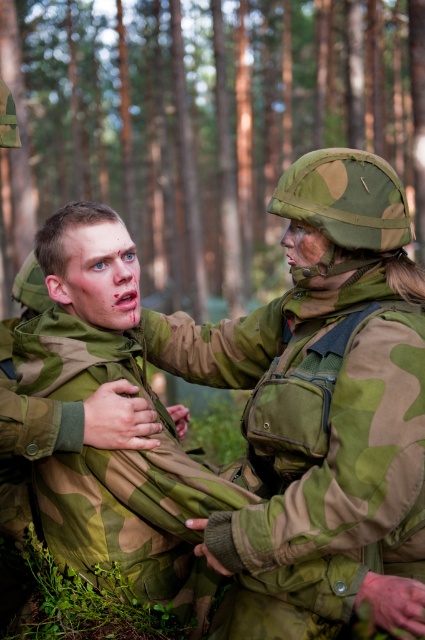
Question: Can you confirm if green camouflage pine forest at upper center is smaller than camo uniform at center?

Choices:
 (A) no
 (B) yes

Answer: (A)

Question: Which of these objects is positioned farthest from the camouflage fabric uniform at center?

Choices:
 (A) camo uniform at center
 (B) green camouflage pine forest at upper center

Answer: (B)

Question: Which of the following is the farthest from the observer?

Choices:
 (A) (275, 154)
 (B) (339, 224)
 (C) (187, 497)

Answer: (A)

Question: Does green camouflage pine forest at upper center have a greater width compared to camouflage fabric uniform at center?

Choices:
 (A) yes
 (B) no

Answer: (A)

Question: Can you confirm if green camouflage pine forest at upper center is positioned to the left of camouflage fabric uniform at center?

Choices:
 (A) yes
 (B) no

Answer: (A)

Question: Among these points, which one is nearest to the camera?

Choices:
 (A) (337, 49)
 (B) (85, 372)
 (C) (329, 193)

Answer: (C)